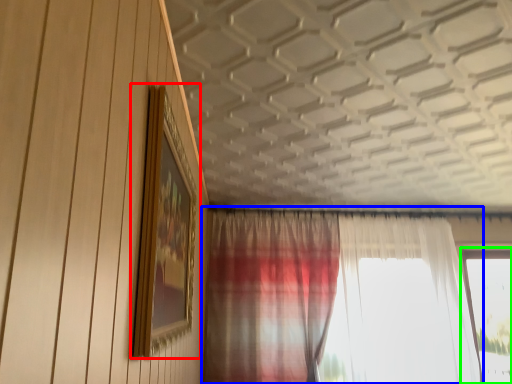
Question: Which object is positioned farthest from picture frame (highlighted by a red box)? Select from curtain (highlighted by a blue box) and window (highlighted by a green box).

Choices:
 (A) curtain
 (B) window

Answer: (B)